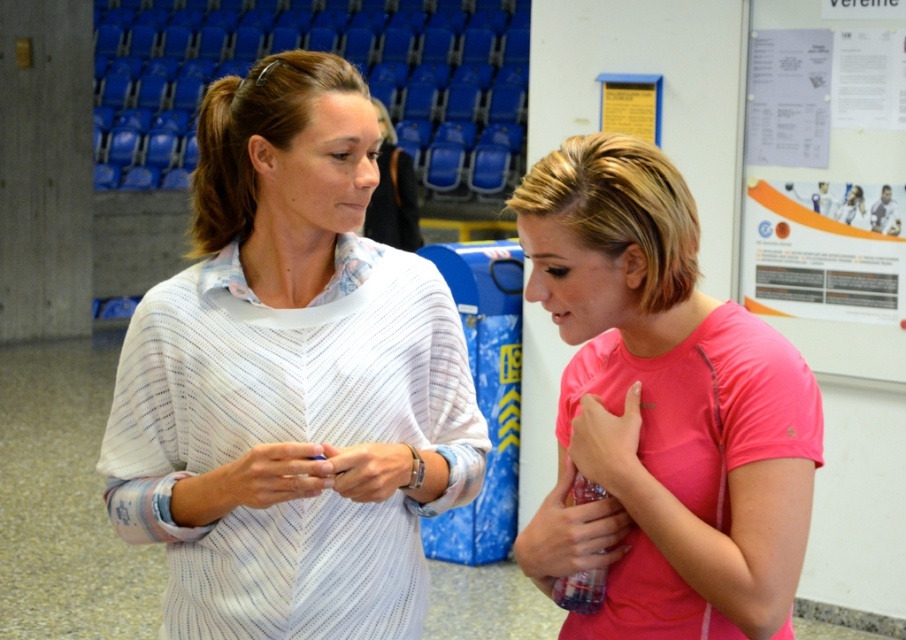
Can you confirm if transparent plastic bottle at right is bigger than matte plastic ring at center?

Correct, transparent plastic bottle at right is larger in size than matte plastic ring at center.

Which is more to the left, transparent plastic bottle at right or matte plastic ring at center?

From the viewer's perspective, matte plastic ring at center appears more on the left side.

At what (x,y) coordinates should I click in order to perform the action: click on transparent plastic bottle at right. Please return your answer as a coordinate pair (x, y). The height and width of the screenshot is (640, 906). Looking at the image, I should click on (570, 532).

Where is `transparent plastic bottle at right`? transparent plastic bottle at right is located at coordinates (570, 532).

Is pink matte shirt at center further to camera compared to matte plastic ring at center?

No, pink matte shirt at center is in front of matte plastic ring at center.

Does pink matte shirt at center have a smaller size compared to matte plastic ring at center?

No.

Does point (619, 356) lie in front of point (223, 483)?

No, (619, 356) is behind (223, 483).

This screenshot has height=640, width=906. Identify the location of pink matte shirt at center. (662, 410).

What do you see at coordinates (570, 532) in the screenshot? I see `transparent plastic bottle at right` at bounding box center [570, 532].

What do you see at coordinates (570, 532) in the screenshot? I see `transparent plastic bottle at right` at bounding box center [570, 532].

The width and height of the screenshot is (906, 640). Identify the location of transparent plastic bottle at right. (570, 532).